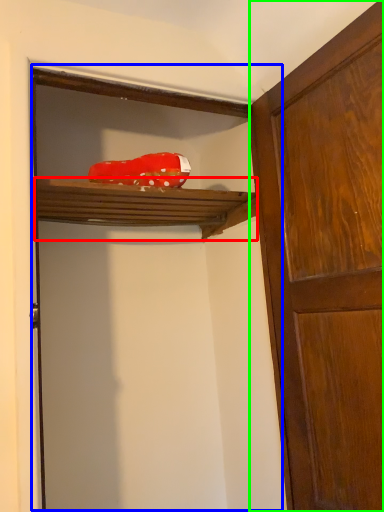
Question: Which object is positioned farthest from shelf (highlighted by a red box)? Select from door (highlighted by a blue box) and door (highlighted by a green box).

Choices:
 (A) door
 (B) door

Answer: (B)